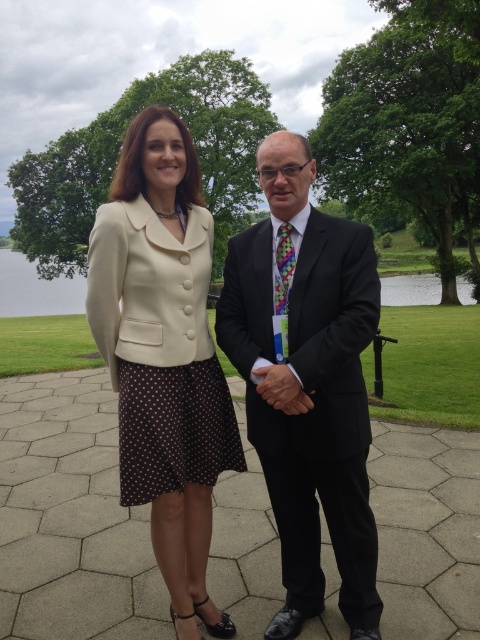
Can you confirm if matte black suit at center is shorter than cream matte blazer at center?

In fact, matte black suit at center may be taller than cream matte blazer at center.

This screenshot has width=480, height=640. What do you see at coordinates (308, 381) in the screenshot?
I see `matte black suit at center` at bounding box center [308, 381].

What are the coordinates of `matte black suit at center` in the screenshot? It's located at (308, 381).

Does cream matte blazer at center have a lesser width compared to smooth leather hand at center?

No, cream matte blazer at center is not thinner than smooth leather hand at center.

Does point (207, 385) come closer to viewer compared to point (291, 396)?

That is False.

Between point (170, 147) and point (284, 371), which one is positioned in front?

Point (284, 371) is more forward.

You are a GUI agent. You are given a task and a screenshot of the screen. Output one action in this format:
    pyautogui.click(x=<x>, y=<y>)
    Task: Click on the cream matte blazer at center
    This screenshot has height=640, width=480.
    Given the screenshot: What is the action you would take?
    pyautogui.click(x=164, y=355)

Can you confirm if matte black suit at center is smaller than smooth leather hand at center?

Actually, matte black suit at center might be larger than smooth leather hand at center.

Can you confirm if matte black suit at center is positioned above smooth leather hand at center?

Indeed, matte black suit at center is positioned over smooth leather hand at center.

What do you see at coordinates (308, 381) in the screenshot? The height and width of the screenshot is (640, 480). I see `matte black suit at center` at bounding box center [308, 381].

What are the coordinates of `matte black suit at center` in the screenshot? It's located at (308, 381).